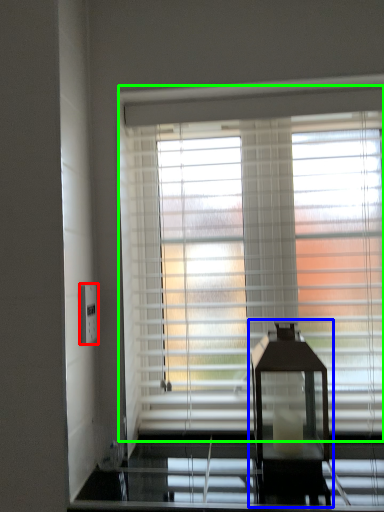
Question: Which object is the farthest from electric outlet (highlighted by a red box)? Choose among these: table lamp (highlighted by a blue box) or window blind (highlighted by a green box).

Choices:
 (A) table lamp
 (B) window blind

Answer: (A)